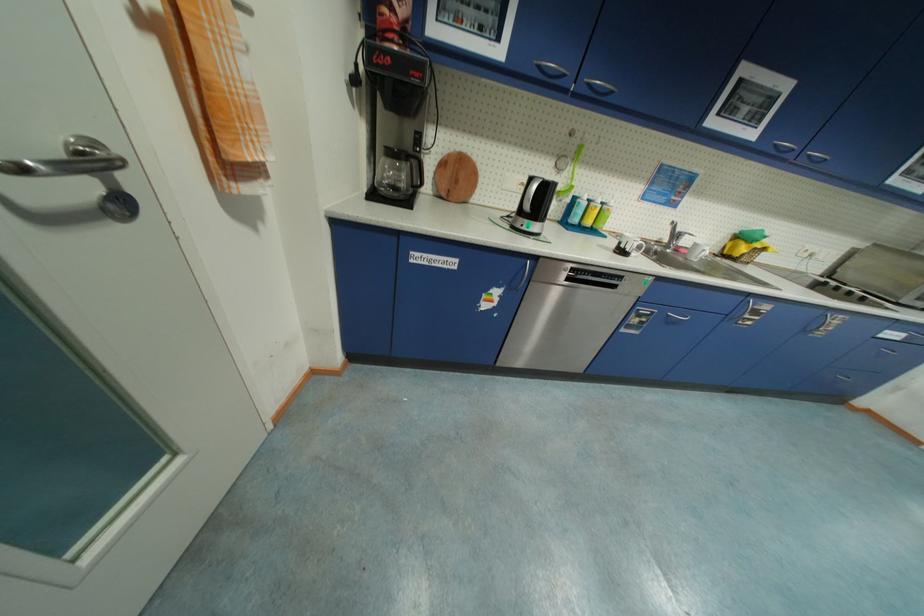
The location [570,174] corresponds to which object?

It corresponds to the green spray bottle in the image.